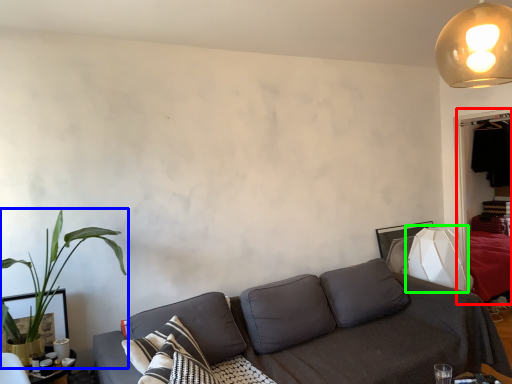
Question: Which object is the farthest from dresser (highlighted by a red box)? Choose among these: houseplant (highlighted by a blue box) or table lamp (highlighted by a green box).

Choices:
 (A) houseplant
 (B) table lamp

Answer: (A)